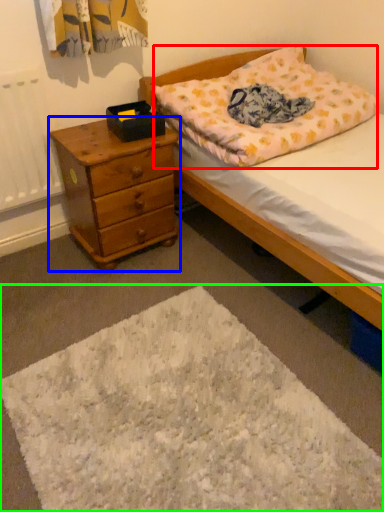
Question: Considering the real-world distances, which object is closest to pillow (highlighted by a red box)? chest of drawers (highlighted by a blue box) or mat (highlighted by a green box).

Choices:
 (A) chest of drawers
 (B) mat

Answer: (A)